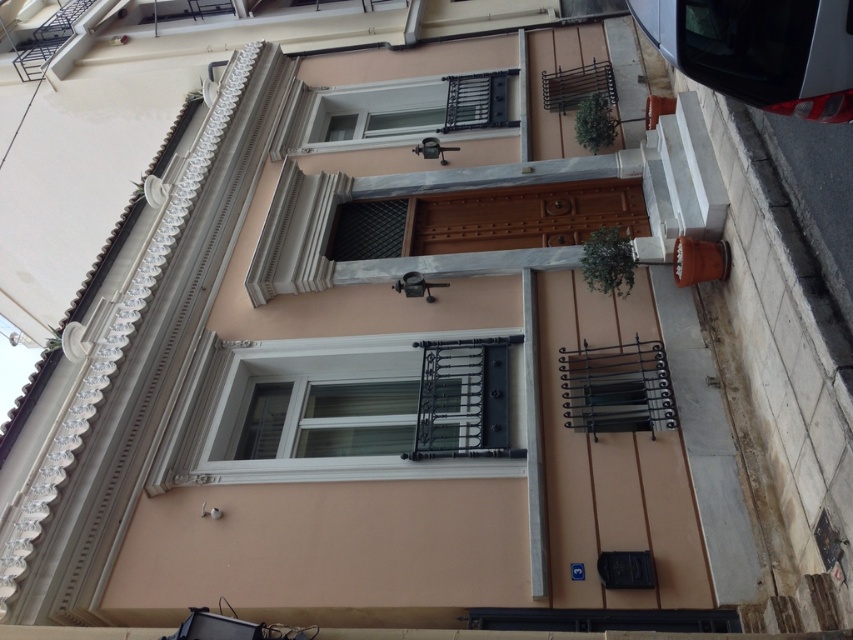
Question: Does white matte window at center have a lesser width compared to white plastic window at upper center?

Choices:
 (A) no
 (B) yes

Answer: (A)

Question: Which point appears farthest from the camera in this image?

Choices:
 (A) (408, 128)
 (B) (212, 454)

Answer: (A)

Question: Which point appears farthest from the camera in this image?

Choices:
 (A) (370, 340)
 (B) (405, 88)

Answer: (B)

Question: Is white matte window at center bigger than white plastic window at upper center?

Choices:
 (A) no
 (B) yes

Answer: (B)

Question: Which point appears closest to the camera in this image?

Choices:
 (A) (444, 88)
 (B) (270, 392)

Answer: (B)

Question: Does white matte window at center have a smaller size compared to white plastic window at upper center?

Choices:
 (A) no
 (B) yes

Answer: (A)